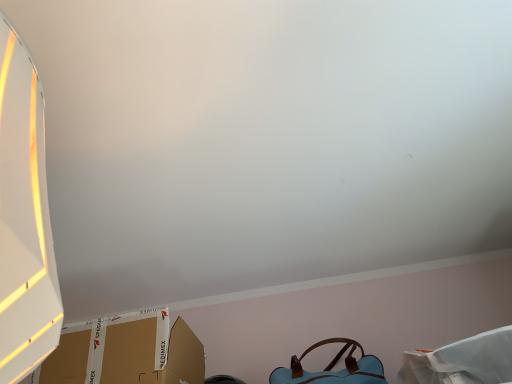
Find the location of a particular element. The image size is (512, 384). brown cardboard box at lower left is located at coordinates (126, 352).

This screenshot has height=384, width=512. What do you see at coordinates (126, 352) in the screenshot?
I see `brown cardboard box at lower left` at bounding box center [126, 352].

In order to face light blue leather handbag at lower right, should I rotate leftwards or rightwards?

It's best to rotate right around 9.226 degrees.

Identify the location of light blue leather handbag at lower right. Image resolution: width=512 pixels, height=384 pixels. (332, 367).

What do you see at coordinates (332, 367) in the screenshot? I see `light blue leather handbag at lower right` at bounding box center [332, 367].

This screenshot has width=512, height=384. I want to click on brown cardboard box at lower left, so click(x=126, y=352).

Considering the positions of objects brown cardboard box at lower left and light blue leather handbag at lower right in the image provided, who is more to the right, brown cardboard box at lower left or light blue leather handbag at lower right?

Positioned to the right is light blue leather handbag at lower right.

Which object is closer to the camera, brown cardboard box at lower left or light blue leather handbag at lower right?

Positioned in front is brown cardboard box at lower left.

Considering the points (192, 337) and (274, 376), which point is in front, point (192, 337) or point (274, 376)?

The point (274, 376) is more forward.

From the image's perspective, is brown cardboard box at lower left above or below light blue leather handbag at lower right?

brown cardboard box at lower left is above light blue leather handbag at lower right.

From a real-world perspective, which object rests below the other?

In real-world perspective, brown cardboard box at lower left is lower.

Does brown cardboard box at lower left have a greater width compared to light blue leather handbag at lower right?

Yes.

Between brown cardboard box at lower left and light blue leather handbag at lower right, which one has more height?

brown cardboard box at lower left.

Looking at the image, does brown cardboard box at lower left seem bigger or smaller compared to light blue leather handbag at lower right?

In the image, brown cardboard box at lower left appears to be larger than light blue leather handbag at lower right.

Can we say brown cardboard box at lower left lies outside light blue leather handbag at lower right?

Absolutely, brown cardboard box at lower left is external to light blue leather handbag at lower right.

Is brown cardboard box at lower left next to light blue leather handbag at lower right?

brown cardboard box at lower left and light blue leather handbag at lower right are clearly separated.

Based on the photo, is brown cardboard box at lower left positioned with its back to light blue leather handbag at lower right?

That's not correct — brown cardboard box at lower left is not looking away from light blue leather handbag at lower right.

How different are the orientations of brown cardboard box at lower left and light blue leather handbag at lower right in degrees?

The angular difference between brown cardboard box at lower left and light blue leather handbag at lower right is 0.000593 degrees.

At what (x,y) coordinates should I click in order to perform the action: click on cardboard box that appears in front of the light blue leather handbag at lower right. Please return your answer as a coordinate pair (x, y). The height and width of the screenshot is (384, 512). Looking at the image, I should click on (126, 352).

Can you confirm if light blue leather handbag at lower right is positioned to the right of brown cardboard box at lower left?

Yes, light blue leather handbag at lower right is to the right of brown cardboard box at lower left.

Is the depth of light blue leather handbag at lower right less than that of brown cardboard box at lower left?

No, light blue leather handbag at lower right is further to the viewer.

Between point (355, 358) and point (130, 339), which one is positioned behind?

Point (355, 358)

From the image's perspective, which object appears higher, light blue leather handbag at lower right or brown cardboard box at lower left?

brown cardboard box at lower left.

From a real-world perspective, between light blue leather handbag at lower right and brown cardboard box at lower left, who is vertically higher?

From a 3D spatial view, light blue leather handbag at lower right is above.

Considering the relative sizes of light blue leather handbag at lower right and brown cardboard box at lower left in the image provided, is light blue leather handbag at lower right wider than brown cardboard box at lower left?

In fact, light blue leather handbag at lower right might be narrower than brown cardboard box at lower left.

Can you confirm if light blue leather handbag at lower right is taller than brown cardboard box at lower left?

Incorrect, the height of light blue leather handbag at lower right is not larger of that of brown cardboard box at lower left.

Who is bigger, light blue leather handbag at lower right or brown cardboard box at lower left?

brown cardboard box at lower left.

Would you say light blue leather handbag at lower right contains brown cardboard box at lower left?

Actually, brown cardboard box at lower left is outside light blue leather handbag at lower right.

Is light blue leather handbag at lower right next to brown cardboard box at lower left and touching it?

There is a gap between light blue leather handbag at lower right and brown cardboard box at lower left.

Is light blue leather handbag at lower right oriented away from brown cardboard box at lower left?

No.

How much distance is there between light blue leather handbag at lower right and brown cardboard box at lower left?

The distance of light blue leather handbag at lower right from brown cardboard box at lower left is 18.73 inches.

Locate an element on the screen. The height and width of the screenshot is (384, 512). handbag above the brown cardboard box at lower left (from a real-world perspective) is located at coordinates (332, 367).

Identify the location of cardboard box located underneath the light blue leather handbag at lower right (from a real-world perspective). (126, 352).

Identify the location of handbag lying below the brown cardboard box at lower left (from the image's perspective). This screenshot has height=384, width=512. (332, 367).